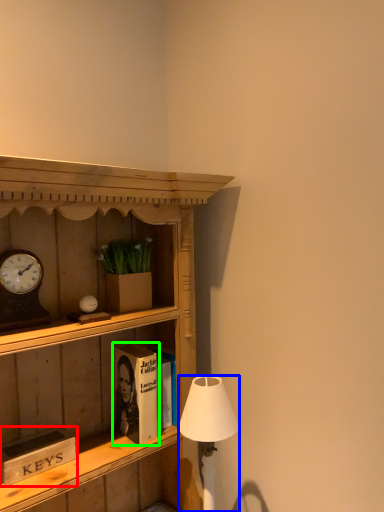
Question: Which is farther away from book (highlighted by a red box)? lamp (highlighted by a blue box) or book (highlighted by a green box)?

Choices:
 (A) lamp
 (B) book

Answer: (A)